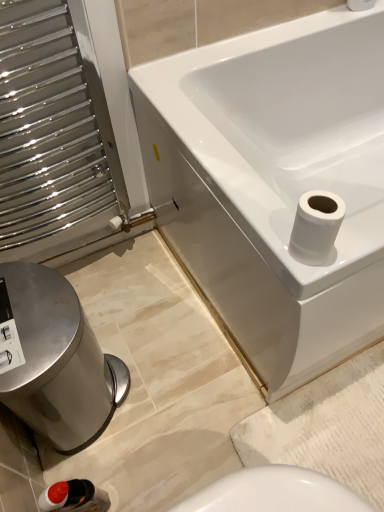
Question: Is matte black bottle at lower left wider or thinner than white glossy bathtub at upper right?

Choices:
 (A) wide
 (B) thin

Answer: (B)

Question: Is point (74, 504) closer or farther from the camera than point (162, 71)?

Choices:
 (A) farther
 (B) closer

Answer: (B)

Question: Which is nearer to the white matte toilet paper at upper right, the second toilet paper in the left-to-right sequence?

Choices:
 (A) polished stainless steel bidet at lower left
 (B) matte black bottle at lower left
 (C) white glossy toilet paper at upper right, which is the 2th toilet paper from top to bottom
 (D) white glossy bathtub at upper right

Answer: (D)

Question: Which object is positioned closest to the white glossy toilet paper at upper right, which is the 2th toilet paper from top to bottom?

Choices:
 (A) white matte toilet paper at upper right, marked as the 2th toilet paper in a bottom-to-top arrangement
 (B) polished stainless steel bidet at lower left
 (C) white glossy bathtub at upper right
 (D) matte black bottle at lower left

Answer: (C)